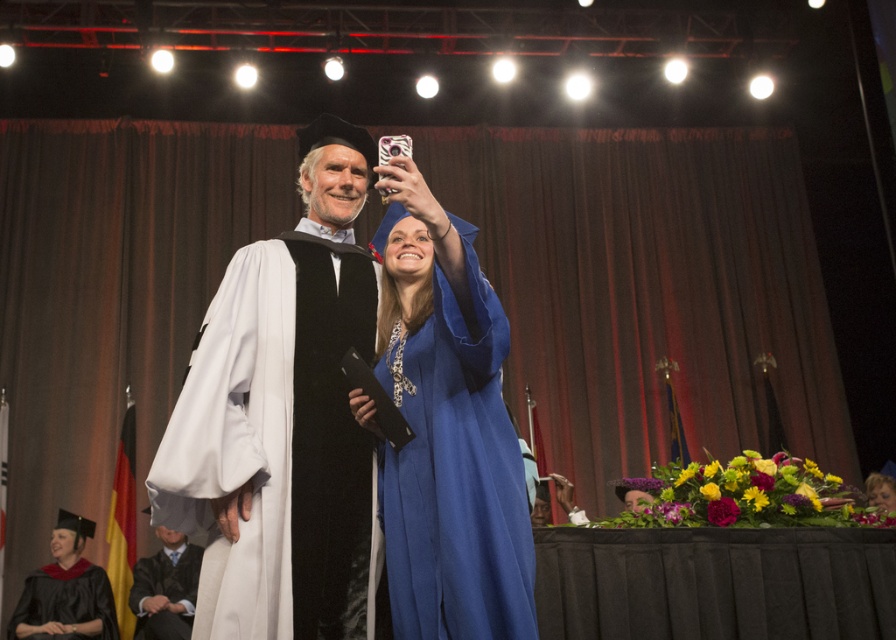
You are a photographer at the graduation ceremony. You need to adjust the lighting to ensure both the matte white gown at center and the white velvet gown at center are visible. Which gown should you focus on first to avoid shadows obscuring details?

The matte white gown at center is above the white velvet gown at center, so focusing on the lower white velvet gown at center first would prevent shadows from the upper gown from casting over it.

You are a photographer at the graduation ceremony. You need to capture a photo of both the matte white gown at center and the white velvet gown at center. Which gown should you focus on first if you want to ensure both are in frame without moving the camera?

The matte white gown at center is larger, so focusing on it first will ensure the white velvet gown at center also stays within the frame since it is smaller.

You are a photographer at the graduation ceremony. You need to capture a photo of both the blue satin gown at center and the matte black graduation gown at lower left. Which gown has a narrower silhouette?

The blue satin gown at center has a narrower silhouette than the matte black graduation gown at lower left because it is thinner.